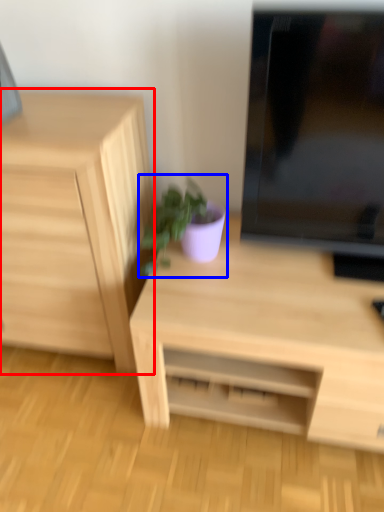
Question: Among these objects, which one is farthest to the camera, chest of drawers (highlighted by a red box) or houseplant (highlighted by a blue box)?

Choices:
 (A) chest of drawers
 (B) houseplant

Answer: (B)